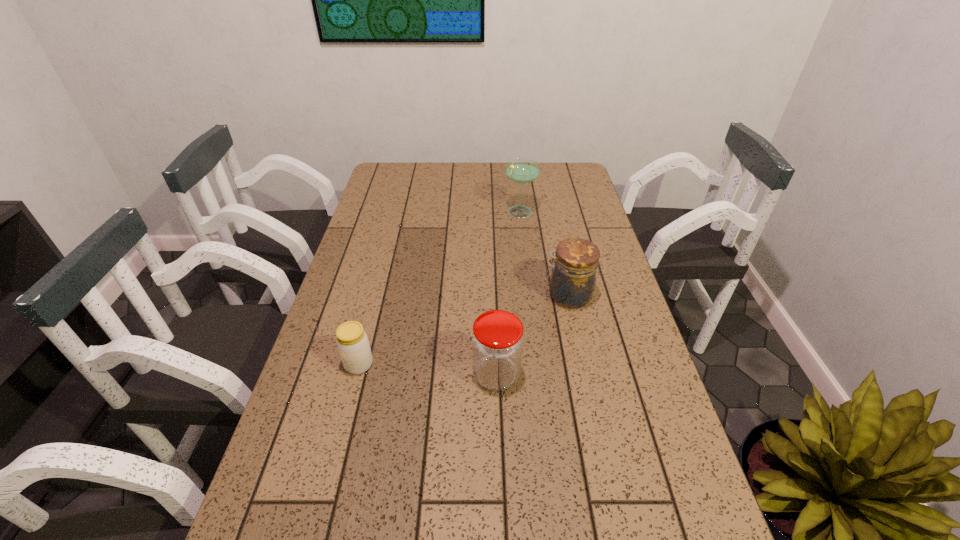
Locate which jar ranks in proximity to the second jar from right to left. Please provide its 2D coordinates. Your answer should be formatted as a tuple, i.e. [(x, y)], where the tuple contains the x and y coordinates of a point satisfying the conditions above.

[(573, 278)]

This screenshot has height=540, width=960. Identify the location of jar that is the second closest to the farthest object. (497, 342).

What are the coordinates of `free region that satisfies the following two spatial constraints: 1. on the lid of the rightmost jar; 2. on the front side of the second jar from right to left` in the screenshot? It's located at (585, 375).